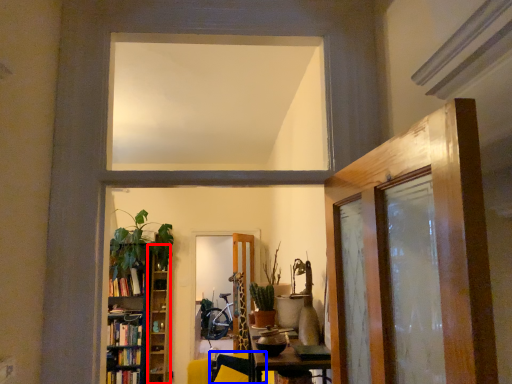
Question: Which object is closer to the camera taking this photo, shelf (highlighted by a red box) or swivel chair (highlighted by a blue box)?

Choices:
 (A) shelf
 (B) swivel chair

Answer: (B)